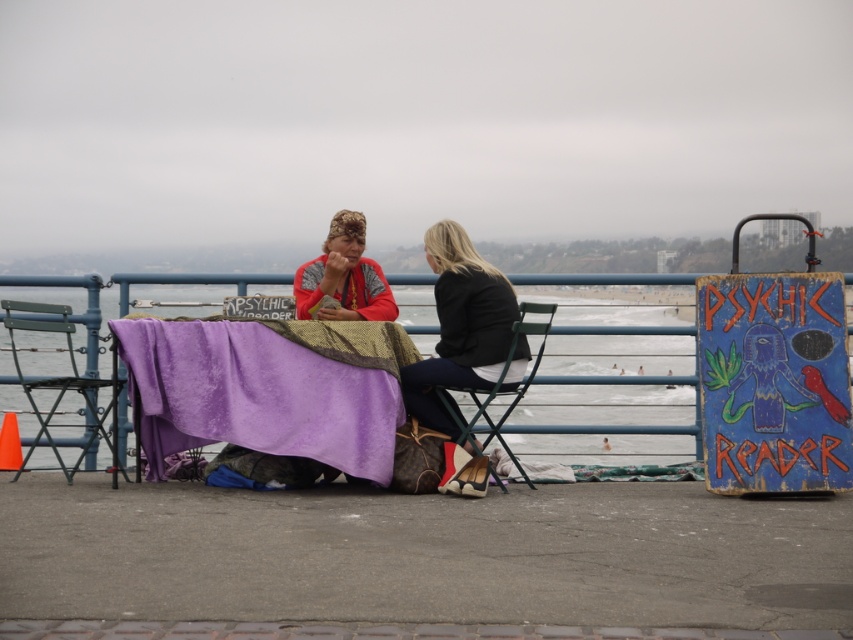
Question: Can you confirm if purple fabric table at center is positioned below green metal chair at center?

Choices:
 (A) yes
 (B) no

Answer: (B)

Question: Is metallic green chair at left to the left of green metal chair at center from the viewer's perspective?

Choices:
 (A) yes
 (B) no

Answer: (A)

Question: Which of the following is the farthest from the observer?

Choices:
 (A) tap(345, 250)
 (B) tap(430, 360)

Answer: (A)

Question: Does metallic green chair at left have a lesser width compared to green metal chair at center?

Choices:
 (A) yes
 (B) no

Answer: (B)

Question: Which object is closer to the camera taking this photo?

Choices:
 (A) metallic green chair at left
 (B) clear blue water at center
 (C) camouflage fabric headscarf at center
 (D) black leather jacket at center

Answer: (A)

Question: Which of the following is the closest to the observer?

Choices:
 (A) clear blue water at center
 (B) black leather jacket at center

Answer: (B)